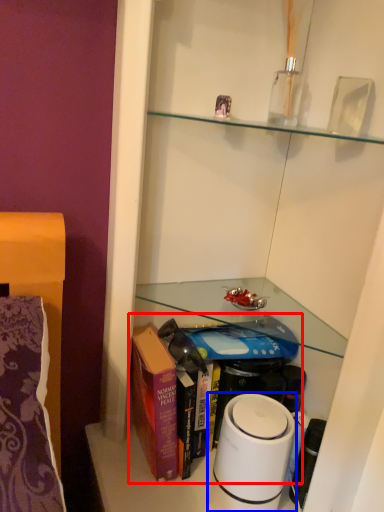
Question: Which object appears closest to the camera in this image, book (highlighted by a red box) or home appliance (highlighted by a blue box)?

Choices:
 (A) book
 (B) home appliance

Answer: (B)